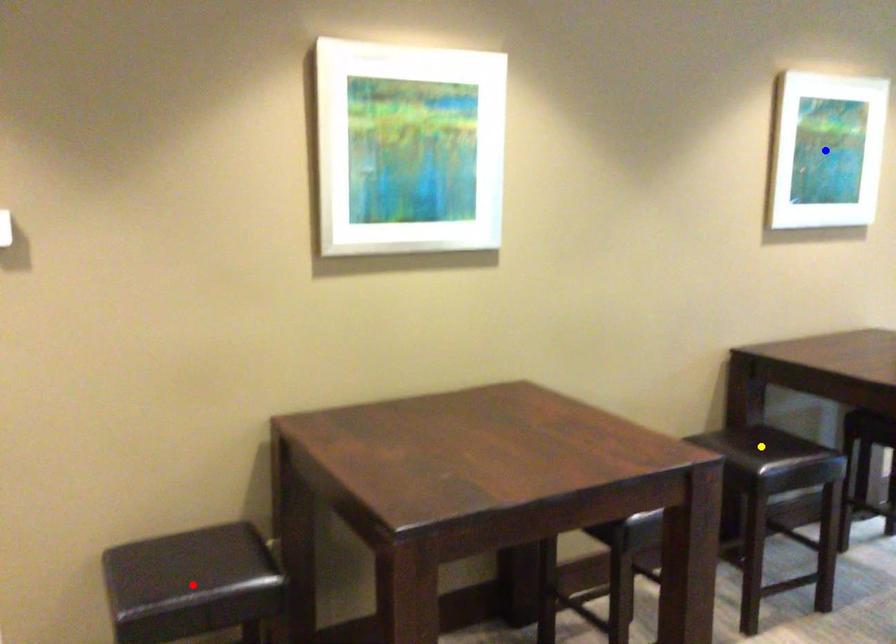
Looking at this image, order these from nearest to farthest:
yellow point
blue point
red point

red point, blue point, yellow point